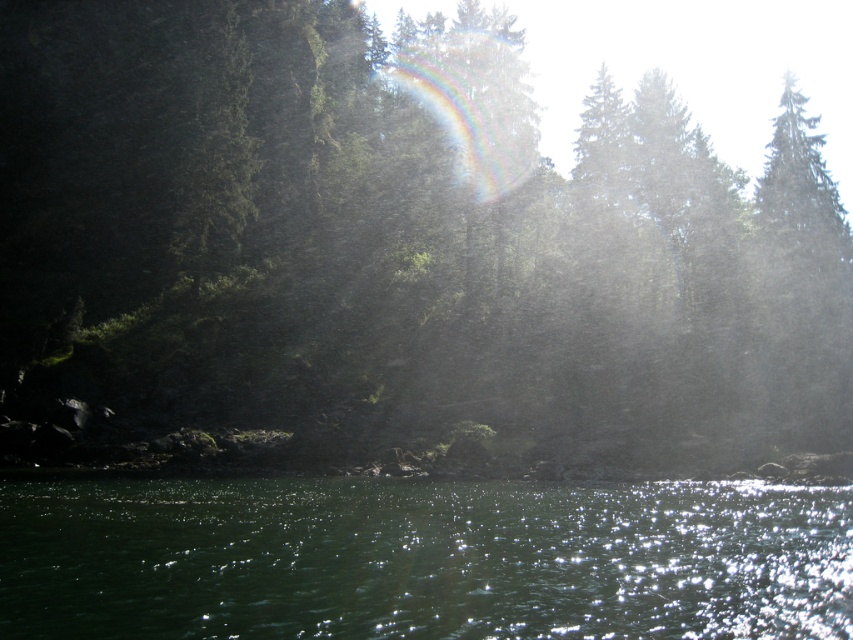
Question: Among these points, which one is farthest from the camera?

Choices:
 (A) (520, 92)
 (B) (561, 636)

Answer: (A)

Question: Is green matte tree at center to the left of rainbow translucent at upper center from the viewer's perspective?

Choices:
 (A) yes
 (B) no

Answer: (A)

Question: Which point is farther to the camera?

Choices:
 (A) (509, 109)
 (B) (258, 609)
 (C) (44, 124)

Answer: (A)

Question: Is green matte tree at center in front of green liquid at lower center?

Choices:
 (A) no
 (B) yes

Answer: (A)

Question: Can you confirm if green matte tree at center is positioned below green liquid at lower center?

Choices:
 (A) yes
 (B) no

Answer: (B)

Question: Which point is farther to the camera?

Choices:
 (A) rainbow translucent at upper center
 (B) green matte tree at center
 (C) green liquid at lower center

Answer: (A)